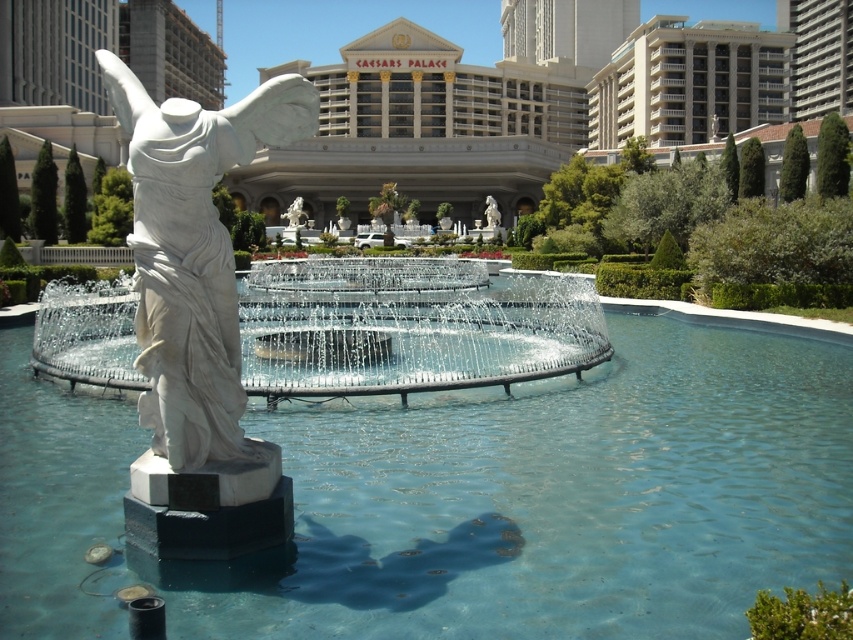
Who is positioned more to the right, clear glass pool at center or white marble statue at center?

clear glass pool at center

Between point (399, 582) and point (221, 442), which one is positioned in front?

Positioned in front is point (399, 582).

The image size is (853, 640). Describe the element at coordinates (468, 499) in the screenshot. I see `clear glass pool at center` at that location.

This screenshot has width=853, height=640. Find the location of `clear glass pool at center`. clear glass pool at center is located at coordinates (468, 499).

Is clear glass pool at center behind white marble fountain at center?

No.

Does clear glass pool at center appear on the left side of white marble fountain at center?

In fact, clear glass pool at center is to the right of white marble fountain at center.

The height and width of the screenshot is (640, 853). In order to click on clear glass pool at center in this screenshot , I will do `click(468, 499)`.

Does white marble fountain at center lie in front of white marble statue at center?

No, white marble fountain at center is further to the viewer.

Who is more distant from viewer, (335, 268) or (177, 296)?

The point (335, 268) is more distant.

You are a GUI agent. You are given a task and a screenshot of the screen. Output one action in this format:
    pyautogui.click(x=<x>, y=<y>)
    Task: Click on the white marble fountain at center
    The height and width of the screenshot is (640, 853).
    Given the screenshot: What is the action you would take?
    265,330